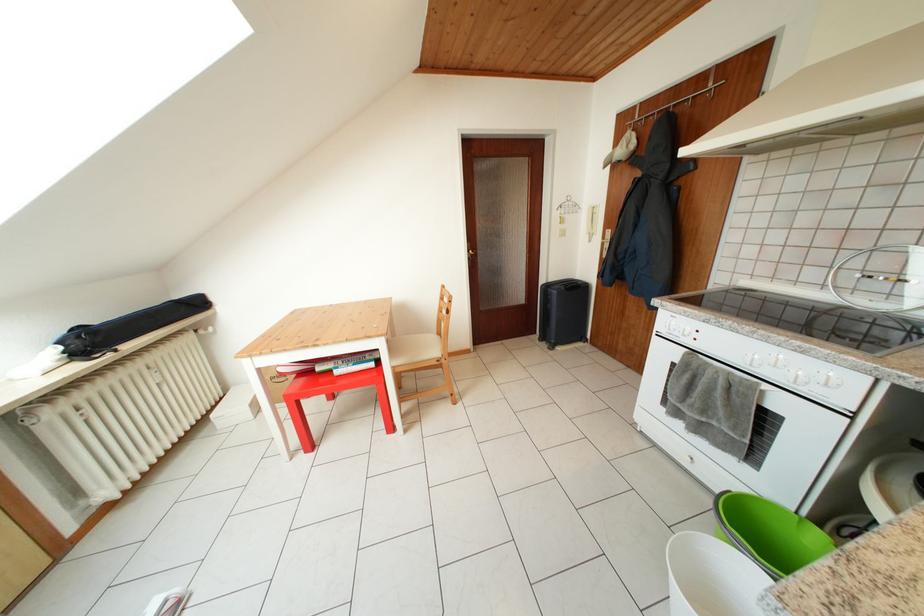
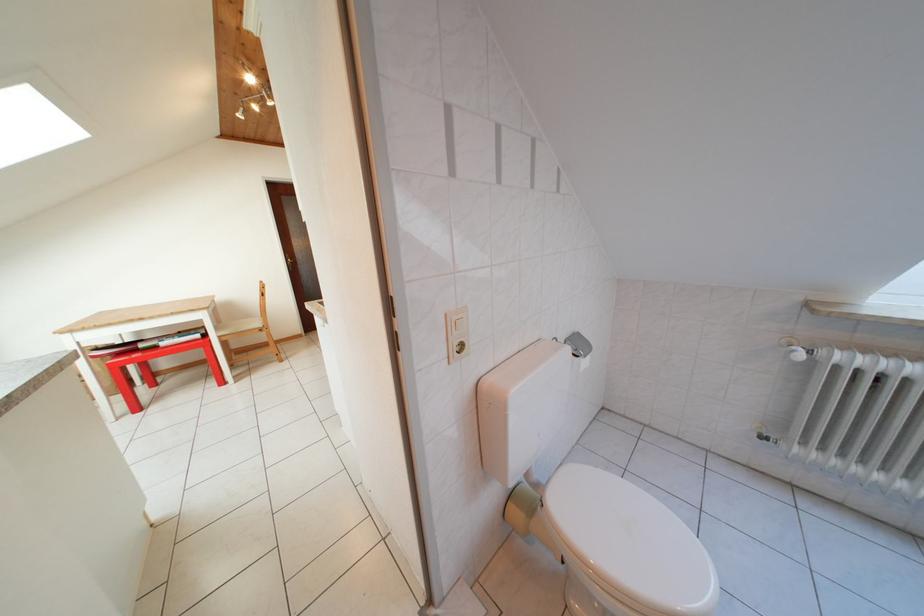
Which direction would the cameraman need to move to produce the second image?

The cameraman moved toward right, backward.